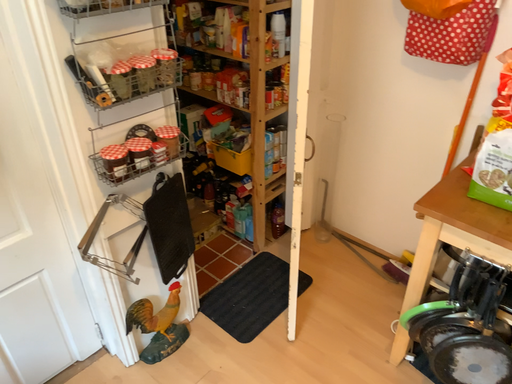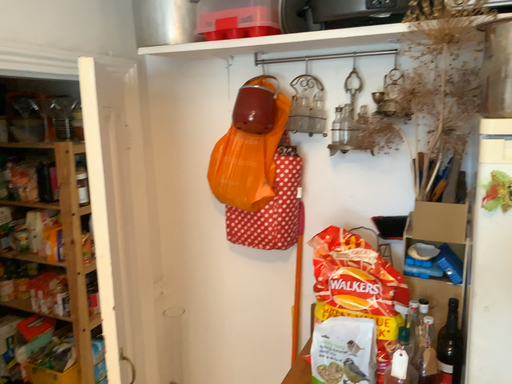
Question: How did the camera likely rotate when shooting the video?

Choices:
 (A) rotated upward
 (B) rotated downward

Answer: (A)